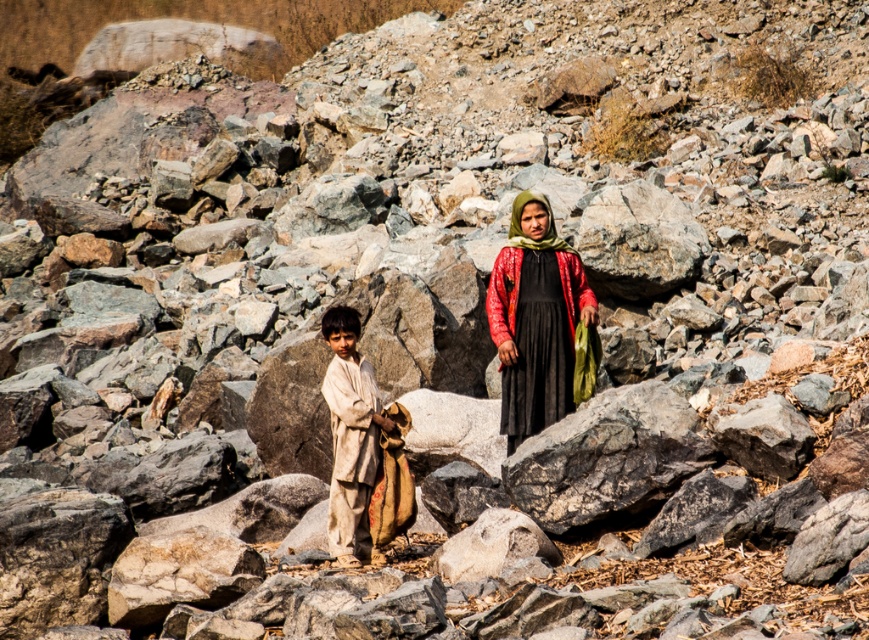
Question: Based on their relative distances, which object is nearer to the red textured fabric at center?

Choices:
 (A) green textured shawl at center
 (B) light beige fabric at center

Answer: (A)

Question: Is red textured fabric at center positioned behind light beige fabric at center?

Choices:
 (A) no
 (B) yes

Answer: (B)

Question: Estimate the real-world distances between objects in this image. Which object is closer to the light beige fabric at center?

Choices:
 (A) green textured shawl at center
 (B) red textured fabric at center

Answer: (B)

Question: Does red textured fabric at center have a smaller size compared to light beige fabric at center?

Choices:
 (A) yes
 (B) no

Answer: (B)

Question: Which of the following is the closest to the observer?

Choices:
 (A) red textured fabric at center
 (B) green textured shawl at center

Answer: (A)

Question: Does red textured fabric at center appear on the left side of light beige fabric at center?

Choices:
 (A) no
 (B) yes

Answer: (A)